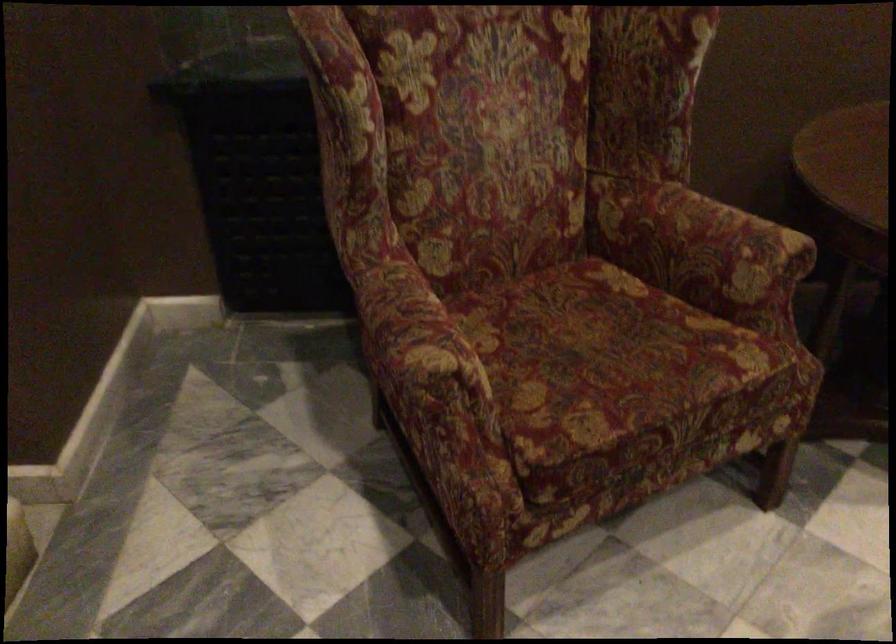
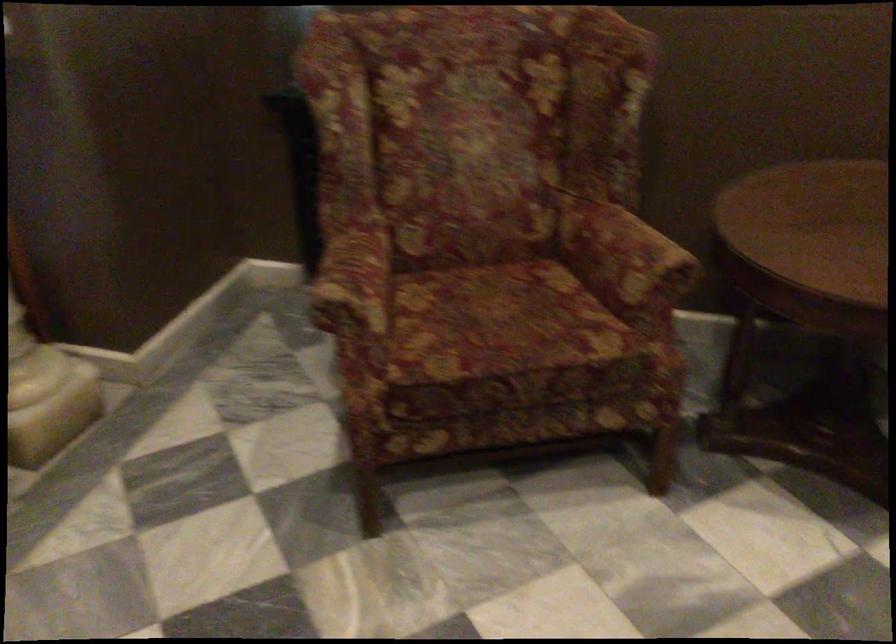
Find the pixel in the second image that matches (x=719, y=251) in the first image.

(624, 258)